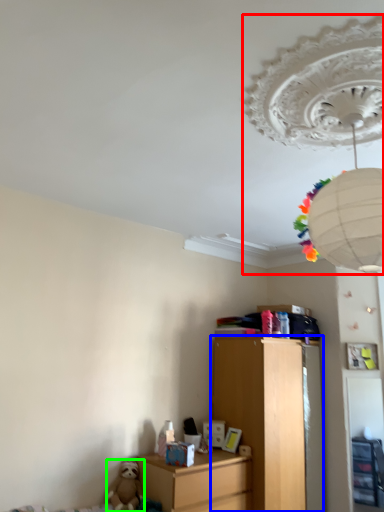
Question: Which is farther away from lamp (highlighted by a red box)? chest of drawers (highlighted by a blue box) or toy (highlighted by a green box)?

Choices:
 (A) chest of drawers
 (B) toy

Answer: (B)